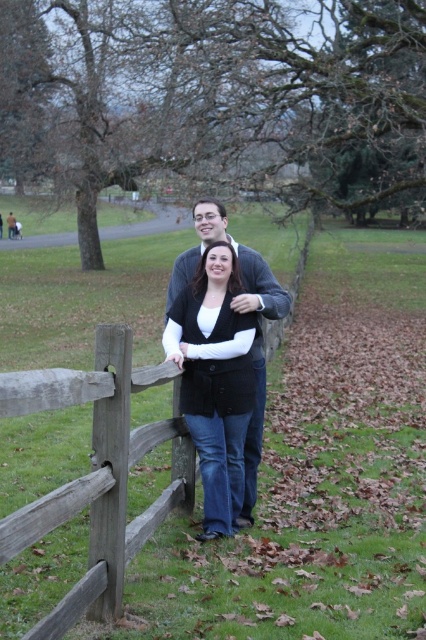
Question: Is brown wooden fence at center wider than black matte vest at center?

Choices:
 (A) yes
 (B) no

Answer: (A)

Question: Is brown wooden fence at center closer to camera compared to black matte vest at center?

Choices:
 (A) yes
 (B) no

Answer: (A)

Question: Among these objects, which one is farthest from the camera?

Choices:
 (A) brown wooden fence at center
 (B) black matte vest at center

Answer: (B)

Question: Can you confirm if brown wooden fence at center is positioned to the right of black matte vest at center?

Choices:
 (A) no
 (B) yes

Answer: (A)

Question: Which point is farther to the camera?

Choices:
 (A) (104, 433)
 (B) (224, 387)

Answer: (B)

Question: Among these points, which one is farthest from the camera?

Choices:
 (A) (114, 432)
 (B) (184, 317)

Answer: (B)